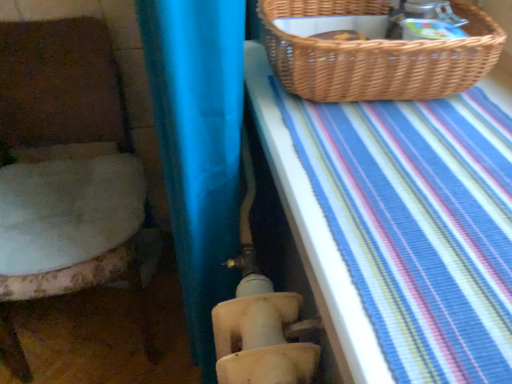
Question: Is fluffy white cushion at left to the left of woven brown picnic basket at upper right from the viewer's perspective?

Choices:
 (A) yes
 (B) no

Answer: (A)

Question: Considering the relative sizes of fluffy white cushion at left and woven brown picnic basket at upper right in the image provided, is fluffy white cushion at left shorter than woven brown picnic basket at upper right?

Choices:
 (A) no
 (B) yes

Answer: (A)

Question: Is fluffy white cushion at left wider than woven brown picnic basket at upper right?

Choices:
 (A) yes
 (B) no

Answer: (A)

Question: From the image's perspective, is fluffy white cushion at left on woven brown picnic basket at upper right?

Choices:
 (A) yes
 (B) no

Answer: (B)

Question: Considering the relative sizes of fluffy white cushion at left and woven brown picnic basket at upper right in the image provided, is fluffy white cushion at left thinner than woven brown picnic basket at upper right?

Choices:
 (A) yes
 (B) no

Answer: (B)

Question: Choose the correct answer: Is fluffy white cushion at left inside woven brown picnic basket at upper right or outside it?

Choices:
 (A) outside
 (B) inside

Answer: (A)

Question: Considering the positions of point (30, 62) and point (496, 43), is point (30, 62) closer or farther from the camera than point (496, 43)?

Choices:
 (A) farther
 (B) closer

Answer: (A)

Question: From their relative heights in the image, would you say fluffy white cushion at left is taller or shorter than woven brown picnic basket at upper right?

Choices:
 (A) short
 (B) tall

Answer: (B)

Question: Is fluffy white cushion at left bigger or smaller than woven brown picnic basket at upper right?

Choices:
 (A) small
 (B) big

Answer: (B)

Question: Considering the positions of point (30, 48) and point (352, 286), is point (30, 48) closer or farther from the camera than point (352, 286)?

Choices:
 (A) farther
 (B) closer

Answer: (A)

Question: Relative to blue striped fabric at upper right, is fluffy white cushion at left in front or behind?

Choices:
 (A) behind
 (B) front

Answer: (A)

Question: Considering the positions of fluffy white cushion at left and blue striped fabric at upper right in the image, is fluffy white cushion at left wider or thinner than blue striped fabric at upper right?

Choices:
 (A) wide
 (B) thin

Answer: (A)

Question: From a real-world perspective, relative to blue striped fabric at upper right, is fluffy white cushion at left vertically above or below?

Choices:
 (A) above
 (B) below

Answer: (B)

Question: From a real-world perspective, is woven brown picnic basket at upper right positioned above or below fluffy white cushion at left?

Choices:
 (A) below
 (B) above

Answer: (B)

Question: Relative to fluffy white cushion at left, is woven brown picnic basket at upper right in front or behind?

Choices:
 (A) front
 (B) behind

Answer: (A)